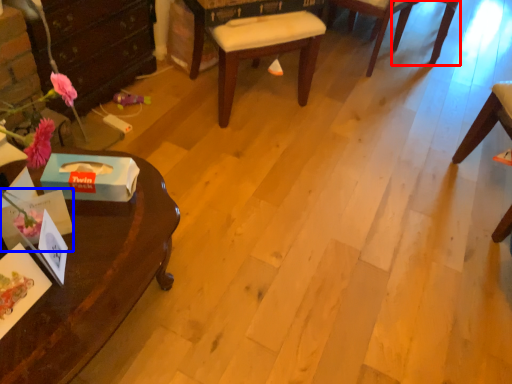
Question: Among these objects, which one is farthest to the camera, chair (highlighted by a red box) or box (highlighted by a blue box)?

Choices:
 (A) chair
 (B) box

Answer: (A)